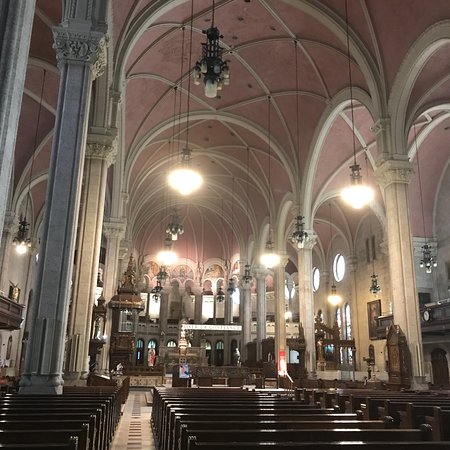
This screenshot has width=450, height=450. I want to click on chandelier, so click(x=214, y=67).